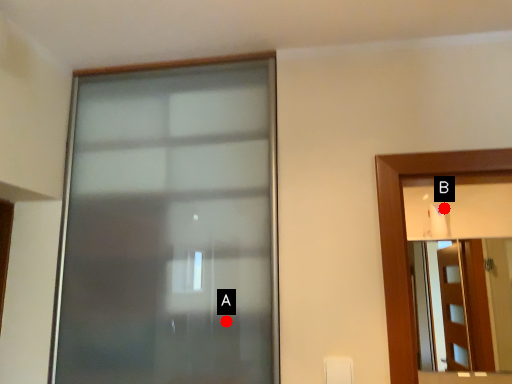
Question: Two points are circled on the image, labeled by A and B beside each circle. Among these points, which one is farthest from the camera?

Choices:
 (A) A is further
 (B) B is further

Answer: (B)